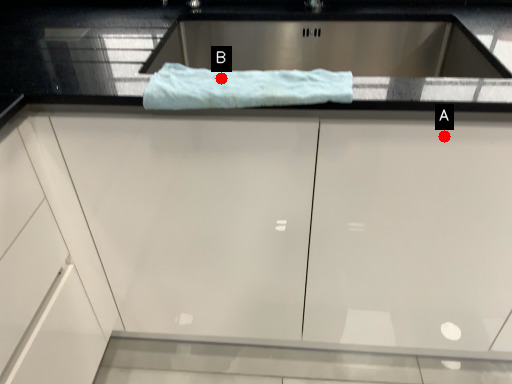
Question: Two points are circled on the image, labeled by A and B beside each circle. Which point is closer to the camera taking this photo?

Choices:
 (A) A is closer
 (B) B is closer

Answer: (B)